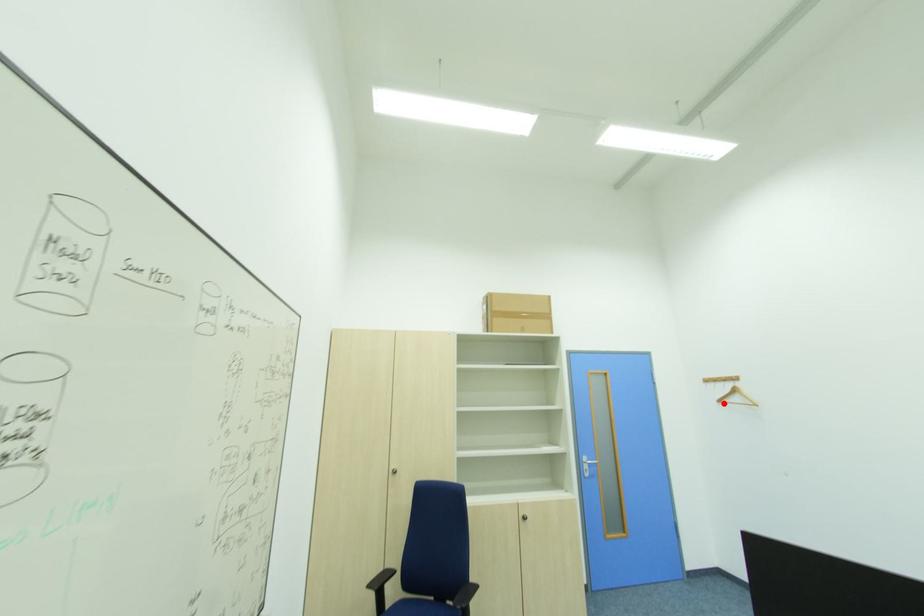
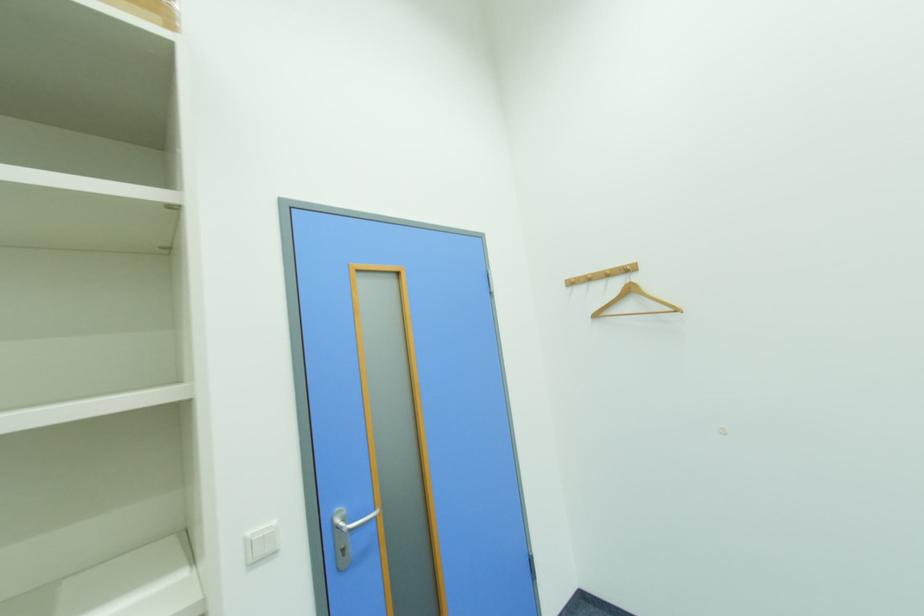
Where in the second image is the point corresponding to the highlighted location from the first image?

(601, 317)